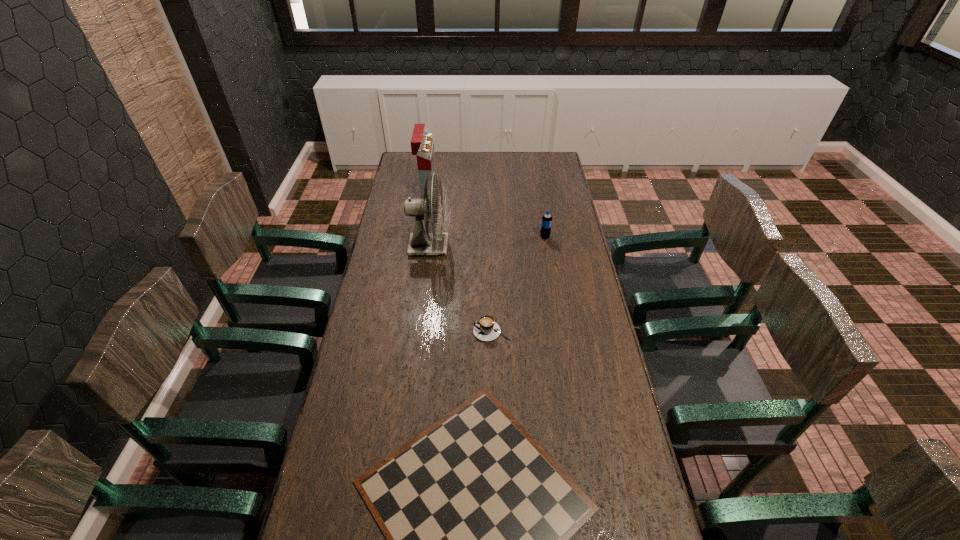
Where is `unoccupied position between the fan and the fourth farthest object`? The height and width of the screenshot is (540, 960). unoccupied position between the fan and the fourth farthest object is located at coordinates (460, 289).

Identify the location of free space between the fourth shortest object and the third shortest object. (486, 213).

I want to click on object that is the fourth closest one to the fan, so click(x=477, y=515).

Where is `object that ranks as the closest to the fan`? This screenshot has height=540, width=960. object that ranks as the closest to the fan is located at coordinates 422,145.

Find the location of a particular element. The height and width of the screenshot is (540, 960). vacant space that satisfies the following two spatial constraints: 1. with the lid open on the farthest object; 2. on the back side of the soda bottle is located at coordinates (420, 237).

Where is `vacant region that satisfies the following two spatial constraints: 1. on the front side of the third tallest object; 2. with the handle on the side of the second nearest object`? Image resolution: width=960 pixels, height=540 pixels. vacant region that satisfies the following two spatial constraints: 1. on the front side of the third tallest object; 2. with the handle on the side of the second nearest object is located at coordinates point(561,332).

At what (x,y) coordinates should I click in order to perform the action: click on vacant position in the image that satisfies the following two spatial constraints: 1. on the front side of the third shortest object; 2. on the front-facing side of the fan. Please return your answer as a coordinate pair (x, y). The image size is (960, 540). Looking at the image, I should click on (546, 247).

The height and width of the screenshot is (540, 960). I want to click on vacant area in the image that satisfies the following two spatial constraints: 1. with the lid open on the third shortest object; 2. on the right side of the cigarette case, so click(x=420, y=237).

Locate an element on the screen. vacant space that satisfies the following two spatial constraints: 1. with the lid open on the fourth shortest object; 2. on the right side of the soda bottle is located at coordinates (420, 237).

Find the location of a particular element. The height and width of the screenshot is (540, 960). free location that satisfies the following two spatial constraints: 1. with the lid open on the cigarette case; 2. on the back side of the third shortest object is located at coordinates (420, 237).